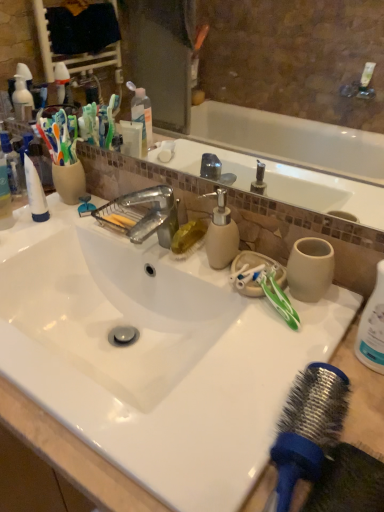
Where is `vacant space situated on the left part of metallic faucet at center`? The image size is (384, 512). vacant space situated on the left part of metallic faucet at center is located at coordinates (70, 238).